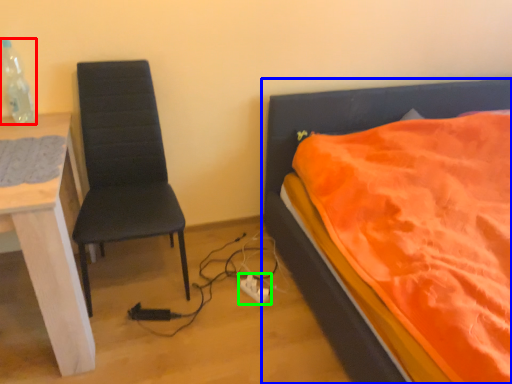
Question: Which is farther away from bottle (highlighted by a red box)? bed (highlighted by a blue box) or power plugs and sockets (highlighted by a green box)?

Choices:
 (A) bed
 (B) power plugs and sockets

Answer: (A)